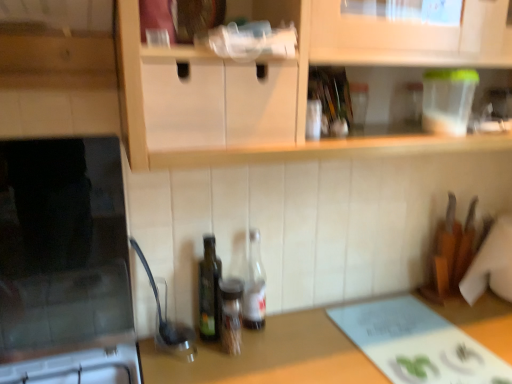
Identify the location of free space to the right of translucent glass spice jar at center, which is the second bottle in left-to-right order. This screenshot has width=512, height=384. (290, 347).